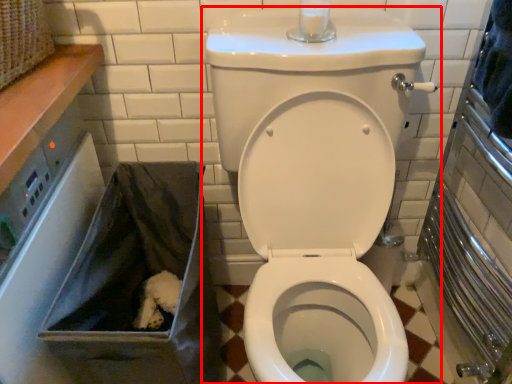
Question: From the image's perspective, considering the relative positions of toilet (annotated by the red box) and recycling bin in the image provided, where is toilet (annotated by the red box) located with respect to the staircase?

Choices:
 (A) below
 (B) above

Answer: (B)